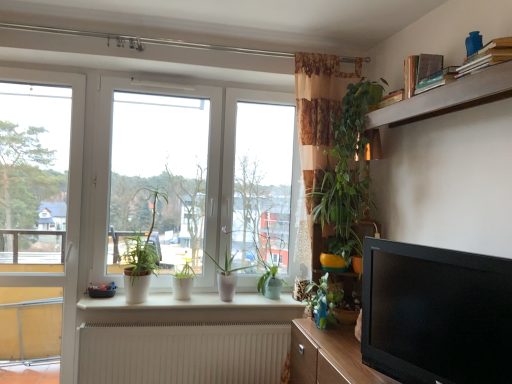
Question: Considering the positions of wooden textured shelf at right, which appears as the 2th shelf when viewed from the front, and white matte pot at window, placed as the 3th houseplant when sorted from left to right, in the image, is wooden textured shelf at right, which appears as the 2th shelf when viewed from the front, bigger or smaller than white matte pot at window, placed as the 3th houseplant when sorted from left to right,?

Choices:
 (A) small
 (B) big

Answer: (B)

Question: Is wooden textured shelf at right, placed as the first shelf when sorted from bottom to top, in front of or behind white matte pot at window, which appears as the 3th houseplant when viewed from the right, in the image?

Choices:
 (A) behind
 (B) front

Answer: (B)

Question: Which object is the closest to the white glossy window at center?

Choices:
 (A) white matte pot at window, which appears as the 3th houseplant when viewed from the right
 (B) black glossy tv at lower right
 (C) green leafy plant at upper center, the 1th houseplant in the right-to-left sequence
 (D) white plastic door at left
 (E) wooden cabinet at lower right

Answer: (A)

Question: Which object is positioned farthest from the wooden cabinet at lower right?

Choices:
 (A) wooden textured shelf at right, the 2th shelf positioned from the top
 (B) blue glossy houseplant at lower center, which is the fourth houseplant from left to right
 (C) beige textured radiator at lower center
 (D) white plastic door at left
 (E) white glossy window at center

Answer: (D)